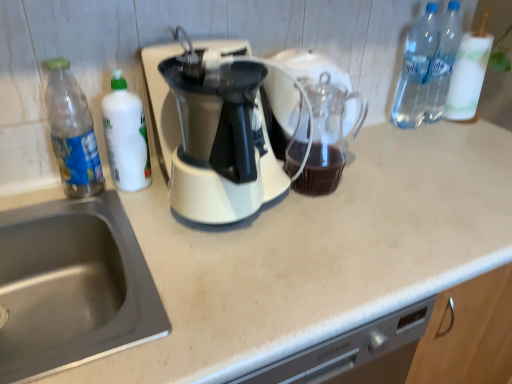
Question: Is stainless steel sink at lower left in front of or behind transparent glass carafe at center in the image?

Choices:
 (A) behind
 (B) front

Answer: (B)

Question: From their relative heights in the image, would you say stainless steel sink at lower left is taller or shorter than transparent glass carafe at center?

Choices:
 (A) short
 (B) tall

Answer: (A)

Question: Which object is the farthest from the beige laminate counter at center?

Choices:
 (A) transparent glass carafe at center
 (B) transparent plastic bottle at left, the first bottle from the left
 (C) clear plastic bottles at upper right, placed as the 2th bottle when sorted from right to left
 (D) white glossy bottle at left, positioned as the 2th bottle in left-to-right order
 (E) clear plastic bottle at upper right, the first bottle from the right

Answer: (B)

Question: Which is nearer to the transparent glass carafe at center?

Choices:
 (A) beige laminate counter at center
 (B) clear plastic bottle at upper right, the 4th bottle when ordered from left to right
 (C) transparent plastic bottle at left, which is counted as the 4th bottle, starting from the right
 (D) clear plastic bottles at upper right, placed as the 2th bottle when sorted from right to left
 (E) stainless steel sink at lower left

Answer: (A)